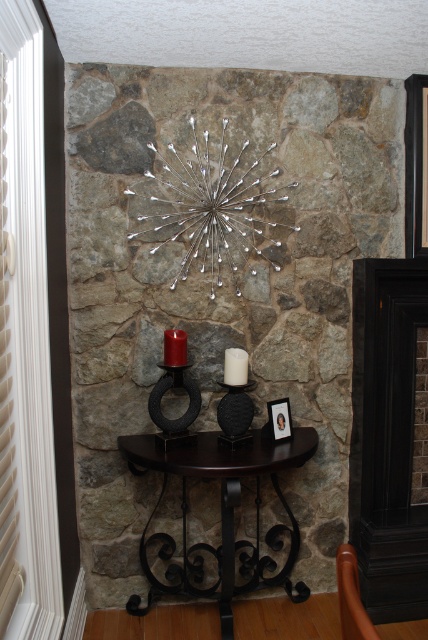
Who is shorter, black matte fireplace at right or white matte candle at center?

white matte candle at center is shorter.

Who is more distant from viewer, (379, 369) or (241, 362)?

The point (379, 369) is more distant.

Where is `black matte fireplace at right`? The width and height of the screenshot is (428, 640). black matte fireplace at right is located at coordinates (386, 436).

Looking at this image, measure the distance between point (261, 474) and camera.

Point (261, 474) and camera are 6.19 feet apart from each other.

Between point (259, 580) and point (243, 403), which one is positioned in front?

Positioned in front is point (243, 403).

Image resolution: width=428 pixels, height=640 pixels. Describe the element at coordinates (220, 513) in the screenshot. I see `dark wood table at center` at that location.

Where is `dark wood table at center`? dark wood table at center is located at coordinates (220, 513).

Does point (410, 400) come in front of point (267, 566)?

Yes, point (410, 400) is in front of point (267, 566).

Between black matte fireplace at right and dark wood table at center, which one has less height?

Standing shorter between the two is dark wood table at center.

Between point (415, 330) and point (282, 449), which one is positioned in front?

Point (282, 449) is in front.

Locate an element on the screen. This screenshot has height=640, width=428. black matte fireplace at right is located at coordinates pos(386,436).